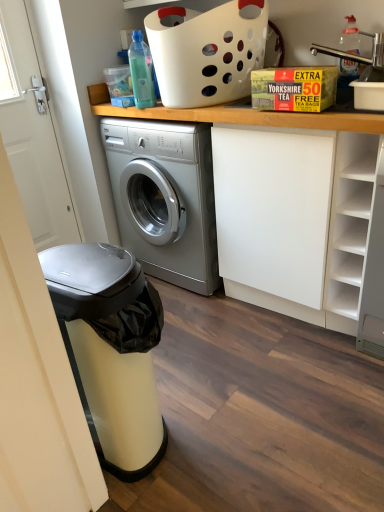
Question: Can you confirm if white plastic basket at upper center is wider than transparent plastic bottle at upper left, arranged as the 2th bottle when viewed from the right?

Choices:
 (A) yes
 (B) no

Answer: (A)

Question: From the image's perspective, is white plastic basket at upper center above transparent plastic bottle at upper left, arranged as the 2th bottle when viewed from the right?

Choices:
 (A) no
 (B) yes

Answer: (B)

Question: Considering the relative positions of white plastic basket at upper center and transparent plastic bottle at upper left, the 1th bottle from the left, in the image provided, is white plastic basket at upper center in front of transparent plastic bottle at upper left, the 1th bottle from the left,?

Choices:
 (A) yes
 (B) no

Answer: (A)

Question: Is white plastic basket at upper center to the left of transparent plastic bottle at upper left, the 1th bottle from the left, from the viewer's perspective?

Choices:
 (A) no
 (B) yes

Answer: (A)

Question: Does white plastic basket at upper center have a smaller size compared to transparent plastic bottle at upper left, arranged as the 2th bottle when viewed from the right?

Choices:
 (A) yes
 (B) no

Answer: (B)

Question: Could you tell me if white plastic basket at upper center is facing transparent plastic bottle at upper left, the 1th bottle from the left?

Choices:
 (A) yes
 (B) no

Answer: (A)

Question: Is transparent plastic bottle at upper left, the 1th bottle from the left, oriented towards yellow cardboard box at upper center?

Choices:
 (A) yes
 (B) no

Answer: (B)

Question: Considering the relative sizes of transparent plastic bottle at upper left, arranged as the 2th bottle when viewed from the right, and yellow cardboard box at upper center in the image provided, is transparent plastic bottle at upper left, arranged as the 2th bottle when viewed from the right, smaller than yellow cardboard box at upper center?

Choices:
 (A) yes
 (B) no

Answer: (A)

Question: Considering the relative positions of transparent plastic bottle at upper left, arranged as the 2th bottle when viewed from the right, and yellow cardboard box at upper center in the image provided, is transparent plastic bottle at upper left, arranged as the 2th bottle when viewed from the right, to the right of yellow cardboard box at upper center from the viewer's perspective?

Choices:
 (A) no
 (B) yes

Answer: (A)

Question: Is transparent plastic bottle at upper left, arranged as the 2th bottle when viewed from the right, next to yellow cardboard box at upper center?

Choices:
 (A) yes
 (B) no

Answer: (B)

Question: From the image's perspective, is transparent plastic bottle at upper left, arranged as the 2th bottle when viewed from the right, below yellow cardboard box at upper center?

Choices:
 (A) yes
 (B) no

Answer: (B)

Question: Is transparent plastic bottle at upper left, arranged as the 2th bottle when viewed from the right, surrounding yellow cardboard box at upper center?

Choices:
 (A) yes
 (B) no

Answer: (B)

Question: Is metallic stainless steel dishwasher at left far from white plastic basket at upper center?

Choices:
 (A) yes
 (B) no

Answer: (A)